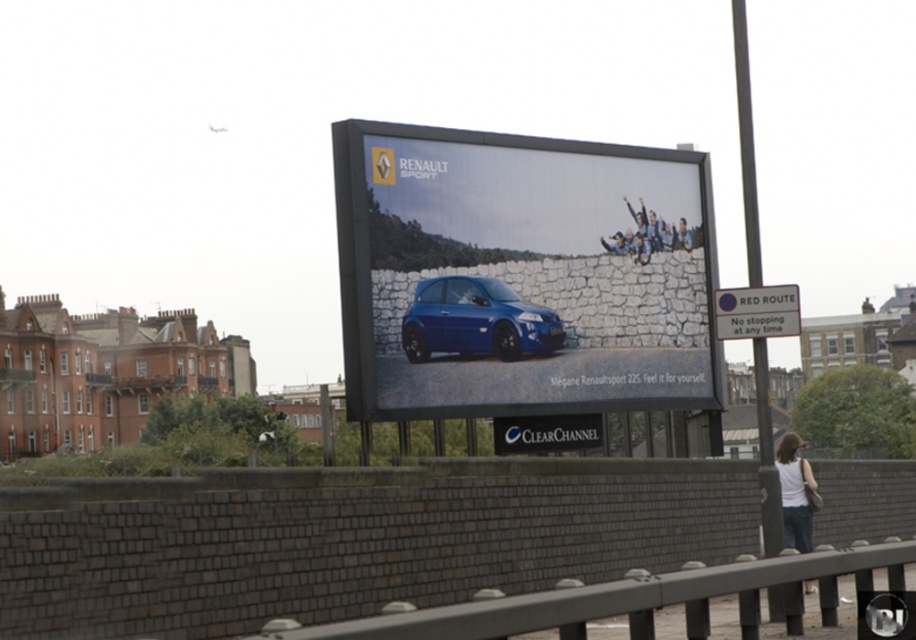
You are a pedestrian standing in front of the billboard. You notice the matte black sign at center and the white fabric shirt at lower right. Which object is closer to you?

The matte black sign at center is closer to you than the white fabric shirt at lower right.

You are a graphic designer checking the layout of the billboard. You notice two elements, the matte black sign at center and the white fabric shirt at lower right. Which one has a smaller width?

The matte black sign at center is thinner than the white fabric shirt at lower right, so the matte black sign at center has a smaller width.